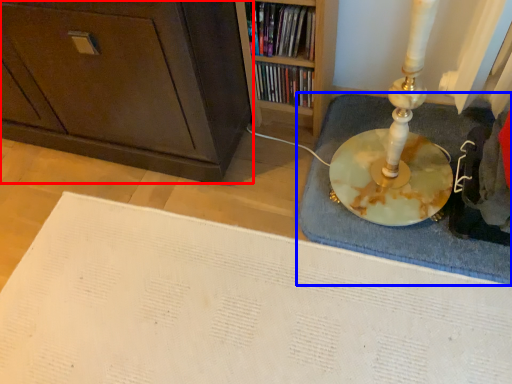
Question: Among these objects, which one is nearest to the camera, cabinetry (highlighted by a red box) or bath mat (highlighted by a blue box)?

Choices:
 (A) cabinetry
 (B) bath mat

Answer: (A)